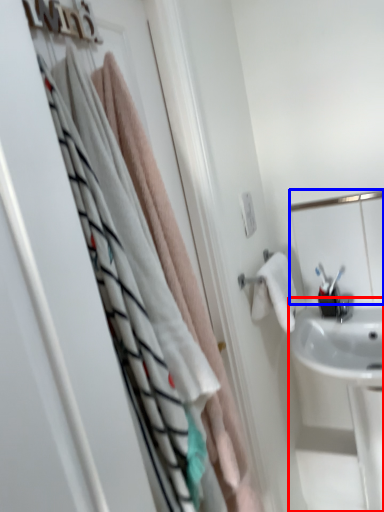
Question: Which object is closer to the camera taking this photo, sink (highlighted by a red box) or mirror (highlighted by a blue box)?

Choices:
 (A) sink
 (B) mirror

Answer: (A)